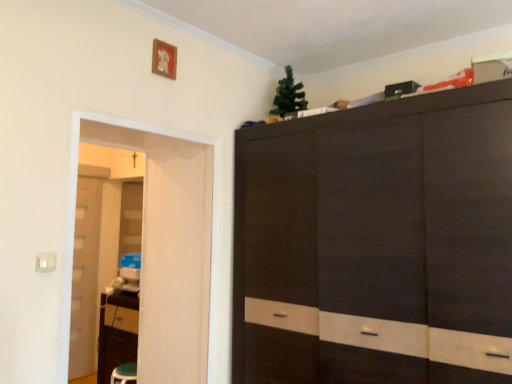
Question: Is white glossy door at left smaller than translucent plastic screen door at left?

Choices:
 (A) yes
 (B) no

Answer: (B)

Question: Is white glossy door at left looking in the opposite direction of translucent plastic screen door at left?

Choices:
 (A) no
 (B) yes

Answer: (A)

Question: From the image's perspective, is white glossy door at left beneath translucent plastic screen door at left?

Choices:
 (A) no
 (B) yes

Answer: (B)

Question: Does white glossy door at left have a larger size compared to translucent plastic screen door at left?

Choices:
 (A) no
 (B) yes

Answer: (B)

Question: Considering the relative sizes of white glossy door at left and translucent plastic screen door at left in the image provided, is white glossy door at left thinner than translucent plastic screen door at left?

Choices:
 (A) yes
 (B) no

Answer: (B)

Question: Does white glossy door at left have a lesser height compared to translucent plastic screen door at left?

Choices:
 (A) yes
 (B) no

Answer: (B)

Question: Considering the relative sizes of translucent plastic screen door at left and white glossy door at left in the image provided, is translucent plastic screen door at left smaller than white glossy door at left?

Choices:
 (A) yes
 (B) no

Answer: (A)

Question: Is translucent plastic screen door at left not inside white glossy door at left?

Choices:
 (A) no
 (B) yes

Answer: (B)

Question: Is translucent plastic screen door at left at the right side of white glossy door at left?

Choices:
 (A) yes
 (B) no

Answer: (A)

Question: Considering the relative sizes of translucent plastic screen door at left and white glossy door at left in the image provided, is translucent plastic screen door at left taller than white glossy door at left?

Choices:
 (A) no
 (B) yes

Answer: (A)

Question: From a real-world perspective, is translucent plastic screen door at left positioned over white glossy door at left based on gravity?

Choices:
 (A) no
 (B) yes

Answer: (B)

Question: Can you confirm if translucent plastic screen door at left is bigger than white glossy door at left?

Choices:
 (A) yes
 (B) no

Answer: (B)

Question: Do you think translucent plastic screen door at left is within white glossy door at left, or outside of it?

Choices:
 (A) outside
 (B) inside

Answer: (A)